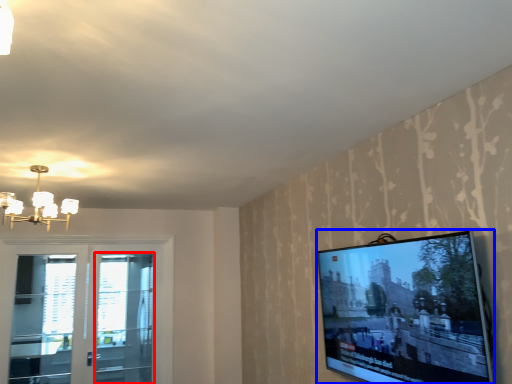
Question: Which object appears farthest to the camera in this image, screen door (highlighted by a red box) or television (highlighted by a blue box)?

Choices:
 (A) screen door
 (B) television

Answer: (A)